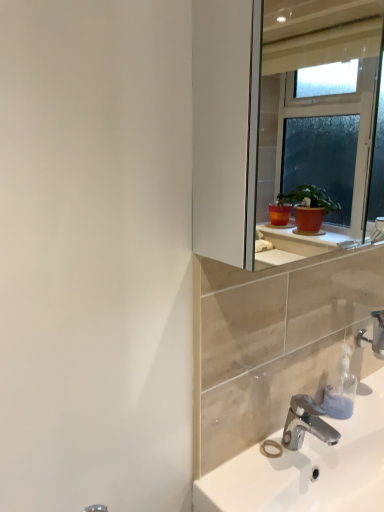
The image size is (384, 512). Describe the element at coordinates (306, 423) in the screenshot. I see `chrome metallic faucet at lower right, which ranks as the second tap in right-to-left order` at that location.

Find the location of a particular element. Image resolution: width=384 pixels, height=512 pixels. silver metallic faucet at lower right, placed as the second tap when sorted from bottom to top is located at coordinates (374, 334).

At what (x,y) coordinates should I click in order to perform the action: click on translucent plastic soap dispenser at lower right. Please return your answer as a coordinate pair (x, y). This screenshot has width=384, height=512. Looking at the image, I should click on (x=341, y=389).

At what (x,y) coordinates should I click in order to perform the action: click on chrome metallic faucet at lower right, which is the first tap in left-to-right order. Please return your answer as a coordinate pair (x, y). The height and width of the screenshot is (512, 384). Looking at the image, I should click on (306, 423).

Looking at this image, in terms of height, does translucent plastic soap dispenser at lower right look taller or shorter compared to white glossy sink at lower right?

translucent plastic soap dispenser at lower right is taller than white glossy sink at lower right.

Between translucent plastic soap dispenser at lower right and white glossy sink at lower right, which one appears on the right side from the viewer's perspective?

From the viewer's perspective, white glossy sink at lower right appears more on the right side.

In the scene shown: Can you tell me how much translucent plastic soap dispenser at lower right and white glossy sink at lower right differ in facing direction?

The facing directions of translucent plastic soap dispenser at lower right and white glossy sink at lower right are 0.661 degrees apart.

Is translucent plastic soap dispenser at lower right beside white glossy sink at lower right?

No.

From the image's perspective, between chrome metallic faucet at lower right, the 1th tap ordered from the bottom, and white glossy sink at lower right, who is located below?

white glossy sink at lower right is shown below in the image.

Does point (306, 397) lie in front of point (367, 452)?

No, (306, 397) is further to viewer.

Is the position of chrome metallic faucet at lower right, which is the first tap in left-to-right order, more distant than that of white glossy sink at lower right?

Yes, it is behind white glossy sink at lower right.

Can translucent plastic soap dispenser at lower right be found inside white glossy sink at lower right?

No.

From the image's perspective, which one is positioned higher, white glossy sink at lower right or translucent plastic soap dispenser at lower right?

translucent plastic soap dispenser at lower right, from the image's perspective.

Does white glossy sink at lower right have a greater width compared to translucent plastic soap dispenser at lower right?

Yes, white glossy sink at lower right is wider than translucent plastic soap dispenser at lower right.

Which of these two, chrome metallic faucet at lower right, which ranks as the first tap in front-to-back order, or silver metallic faucet at lower right, the 1th tap positioned from the back, is thinner?

silver metallic faucet at lower right, the 1th tap positioned from the back, is thinner.

Is chrome metallic faucet at lower right, placed as the second tap when sorted from back to front, to the left of silver metallic faucet at lower right, which is the 1th tap in right-to-left order, from the viewer's perspective?

Yes, chrome metallic faucet at lower right, placed as the second tap when sorted from back to front, is to the left of silver metallic faucet at lower right, which is the 1th tap in right-to-left order.

Who is smaller, chrome metallic faucet at lower right, the 1th tap ordered from the bottom, or silver metallic faucet at lower right, the 1th tap viewed from the top?

silver metallic faucet at lower right, the 1th tap viewed from the top, is smaller.

Could you tell me if chrome metallic faucet at lower right, which ranks as the first tap in front-to-back order, is turned towards silver metallic faucet at lower right, which is the 1th tap in right-to-left order?

No, chrome metallic faucet at lower right, which ranks as the first tap in front-to-back order, is not oriented towards silver metallic faucet at lower right, which is the 1th tap in right-to-left order.

Is silver metallic faucet at lower right, the second tap when ordered from front to back, facing away from chrome metallic faucet at lower right, which ranks as the second tap in right-to-left order?

silver metallic faucet at lower right, the second tap when ordered from front to back, does not have its back to chrome metallic faucet at lower right, which ranks as the second tap in right-to-left order.

In order to click on tap that is below the silver metallic faucet at lower right, placed as the second tap when sorted from bottom to top (from the image's perspective) in this screenshot , I will do `click(306, 423)`.

Are silver metallic faucet at lower right, the second tap when ordered from front to back, and chrome metallic faucet at lower right, which ranks as the first tap in front-to-back order, beside each other?

No, silver metallic faucet at lower right, the second tap when ordered from front to back, is not touching chrome metallic faucet at lower right, which ranks as the first tap in front-to-back order.

Is white glossy sink at lower right inside or outside of silver metallic faucet at lower right, the second tap when ordered from front to back?

white glossy sink at lower right is not inside silver metallic faucet at lower right, the second tap when ordered from front to back, it's outside.

Considering the positions of objects white glossy sink at lower right and silver metallic faucet at lower right, the 1th tap positioned from the back, in the image provided, who is more to the left, white glossy sink at lower right or silver metallic faucet at lower right, the 1th tap positioned from the back,?

white glossy sink at lower right is more to the left.

From the image's perspective, is white glossy sink at lower right located above or below silver metallic faucet at lower right, the second tap when ordered from front to back?

→ white glossy sink at lower right is below silver metallic faucet at lower right, the second tap when ordered from front to back.

Considering the sizes of objects white glossy sink at lower right and silver metallic faucet at lower right, the second tap when ordered from front to back, in the image provided, who is smaller, white glossy sink at lower right or silver metallic faucet at lower right, the second tap when ordered from front to back,?

With smaller size is silver metallic faucet at lower right, the second tap when ordered from front to back.

From the image's perspective, is translucent plastic soap dispenser at lower right above or below silver metallic faucet at lower right, the second tap when ordered from front to back?

translucent plastic soap dispenser at lower right is below silver metallic faucet at lower right, the second tap when ordered from front to back.

Considering the sizes of translucent plastic soap dispenser at lower right and silver metallic faucet at lower right, the 1th tap positioned from the back, in the image, is translucent plastic soap dispenser at lower right wider or thinner than silver metallic faucet at lower right, the 1th tap positioned from the back,?

Clearly, translucent plastic soap dispenser at lower right has less width compared to silver metallic faucet at lower right, the 1th tap positioned from the back.

What's the angular difference between translucent plastic soap dispenser at lower right and silver metallic faucet at lower right, the 1th tap positioned from the back,'s facing directions?

They differ by 0.00153 degrees in their facing directions.

Is point (337, 398) less distant than point (381, 337)?

Yes, it is in front of point (381, 337).

Where is `sink in front of the translucent plastic soap dispenser at lower right`? This screenshot has width=384, height=512. sink in front of the translucent plastic soap dispenser at lower right is located at coordinates (308, 465).

This screenshot has width=384, height=512. Identify the location of tap lying on the left of white glossy sink at lower right. (306, 423).

Looking at this image, estimate the real-world distances between objects in this image. Which object is further from white glossy sink at lower right, silver metallic faucet at lower right, the second tap when ordered from front to back, or chrome metallic faucet at lower right, which is the first tap in left-to-right order?

Based on the image, silver metallic faucet at lower right, the second tap when ordered from front to back, appears to be further to white glossy sink at lower right.

Which object lies nearer to the anchor point chrome metallic faucet at lower right, the 1th tap ordered from the bottom, translucent plastic soap dispenser at lower right or white glossy sink at lower right?

Among the two, white glossy sink at lower right is located nearer to chrome metallic faucet at lower right, the 1th tap ordered from the bottom.

Estimate the real-world distances between objects in this image. Which object is further from silver metallic faucet at lower right, the second tap in the left-to-right sequence, translucent plastic soap dispenser at lower right or chrome metallic faucet at lower right, placed as the second tap when sorted from back to front?

Based on the image, chrome metallic faucet at lower right, placed as the second tap when sorted from back to front, appears to be further to silver metallic faucet at lower right, the second tap in the left-to-right sequence.

From the image, which object appears to be farther from translucent plastic soap dispenser at lower right, silver metallic faucet at lower right, the 1th tap positioned from the back, or chrome metallic faucet at lower right, placed as the second tap when sorted from back to front?

Among the two, silver metallic faucet at lower right, the 1th tap positioned from the back, is located further to translucent plastic soap dispenser at lower right.

Based on their spatial positions, is chrome metallic faucet at lower right, the 1th tap ordered from the bottom, or translucent plastic soap dispenser at lower right closer to white glossy sink at lower right?

chrome metallic faucet at lower right, the 1th tap ordered from the bottom, is closer to white glossy sink at lower right.

Based on their spatial positions, is translucent plastic soap dispenser at lower right or white glossy sink at lower right closer to silver metallic faucet at lower right, the second tap in the left-to-right sequence?

Among the two, translucent plastic soap dispenser at lower right is located nearer to silver metallic faucet at lower right, the second tap in the left-to-right sequence.

Looking at the image, which one is located further to white glossy sink at lower right, translucent plastic soap dispenser at lower right or chrome metallic faucet at lower right, which appears as the second tap when viewed from the top?

Based on the image, translucent plastic soap dispenser at lower right appears to be further to white glossy sink at lower right.

Which object lies nearer to the anchor point chrome metallic faucet at lower right, which appears as the second tap when viewed from the top, white glossy sink at lower right or translucent plastic soap dispenser at lower right?

white glossy sink at lower right is closer to chrome metallic faucet at lower right, which appears as the second tap when viewed from the top.

Find the location of a particular element. This screenshot has width=384, height=512. tap between white glossy sink at lower right and translucent plastic soap dispenser at lower right from front to back is located at coordinates (306, 423).

Identify the location of tap located between white glossy sink at lower right and silver metallic faucet at lower right, the 1th tap positioned from the back, in the depth direction. The height and width of the screenshot is (512, 384). (306, 423).

What are the coordinates of `soap dispenser between chrome metallic faucet at lower right, which ranks as the first tap in front-to-back order, and silver metallic faucet at lower right, the 1th tap positioned from the back, in the horizontal direction` in the screenshot? It's located at (341, 389).

Locate an element on the screen. Image resolution: width=384 pixels, height=512 pixels. soap dispenser between white glossy sink at lower right and silver metallic faucet at lower right, placed as the second tap when sorted from bottom to top, in the front-back direction is located at coordinates (341, 389).